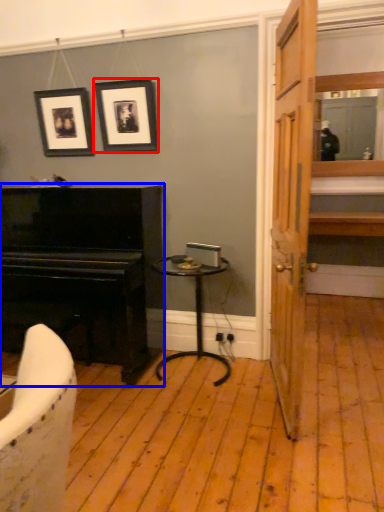
Question: Which object appears closest to the camera in this image, picture frame (highlighted by a red box) or piano (highlighted by a blue box)?

Choices:
 (A) picture frame
 (B) piano

Answer: (B)